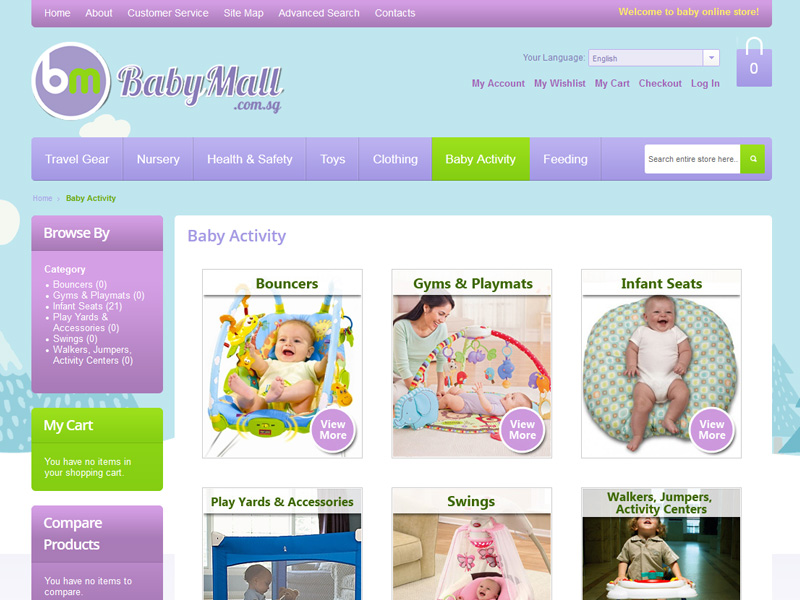
Image resolution: width=800 pixels, height=600 pixels. In order to click on floor in this screenshot , I will do `click(724, 565)`.